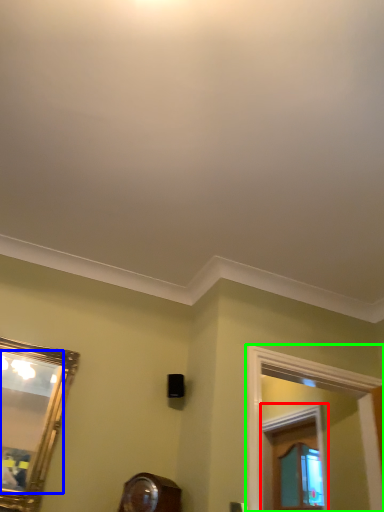
Question: Which is farther away from window frame (highlighted by a red box)? mirror (highlighted by a blue box) or window frame (highlighted by a green box)?

Choices:
 (A) mirror
 (B) window frame

Answer: (A)